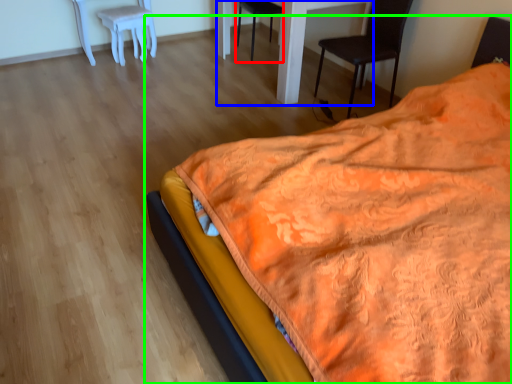
Question: Which object is positioned farthest from chair (highlighted by a red box)? Select from table (highlighted by a blue box) and bed (highlighted by a green box).

Choices:
 (A) table
 (B) bed

Answer: (B)